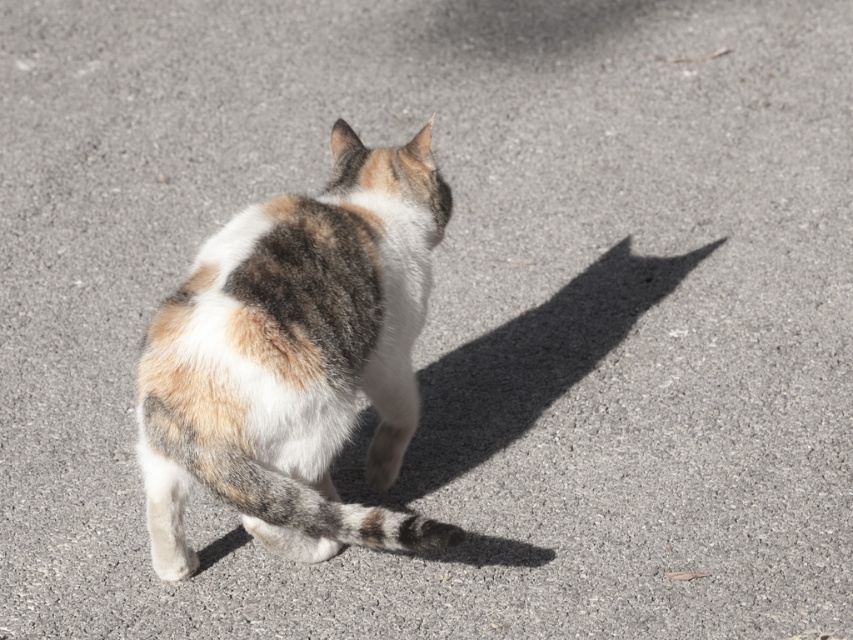
Based on the scene, can you determine if the calico fur cat at center is wider than the gray striped tail at center?

The calico fur cat at center might be wider than gray striped tail at center according to the description.

You are a photographer trying to capture the calico fur cat at center and its gray striped tail at center in a single shot. Based on their positions, will the tail be visible in the photo if you focus on the cat?

The gray striped tail at center is behind the calico fur cat at center, so if you focus on the cat, the tail may still be visible depending on the camera angle and lens. However, since the tail is part of the cat, it should naturally be included in the photo as long as the framing captures the entire cat.

You are a photographer trying to capture the calico fur cat at center and the gray striped tail at center in a single shot. Based on their positions, can you confirm if the tail is visible in the photo?

The calico fur cat at center is above the gray striped tail at center, so the tail is visible in the photo as it is positioned below the cat.